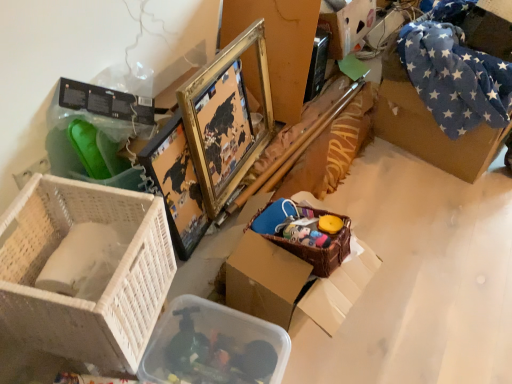
Question: From a real-world perspective, is gold metallic picture frame at upper center physically below white wicker basket at lower left?

Choices:
 (A) no
 (B) yes

Answer: (B)

Question: Is gold metallic picture frame at upper center far from white wicker basket at lower left?

Choices:
 (A) yes
 (B) no

Answer: (B)

Question: From the image's perspective, is gold metallic picture frame at upper center under white wicker basket at lower left?

Choices:
 (A) no
 (B) yes

Answer: (A)

Question: Considering the relative sizes of gold metallic picture frame at upper center and white wicker basket at lower left in the image provided, is gold metallic picture frame at upper center bigger than white wicker basket at lower left?

Choices:
 (A) yes
 (B) no

Answer: (A)

Question: Is gold metallic picture frame at upper center taller than white wicker basket at lower left?

Choices:
 (A) yes
 (B) no

Answer: (A)

Question: Considering their positions, is gold metallic picture frame at upper center located in front of or behind translucent plastic container at lower center, which is the 2th storage box from top to bottom?

Choices:
 (A) behind
 (B) front

Answer: (A)

Question: Does point (204, 110) appear closer or farther from the camera than point (275, 332)?

Choices:
 (A) closer
 (B) farther

Answer: (B)

Question: Visually, is gold metallic picture frame at upper center positioned to the left or to the right of translucent plastic container at lower center, acting as the first storage box starting from the left?

Choices:
 (A) left
 (B) right

Answer: (B)

Question: Looking at their shapes, would you say gold metallic picture frame at upper center is wider or thinner than translucent plastic container at lower center, marked as the 1th storage box in a front-to-back arrangement?

Choices:
 (A) wide
 (B) thin

Answer: (B)

Question: In terms of width, does cardboard box at upper right, positioned as the 1th storage box in back-to-front order, look wider or thinner when compared to white wicker basket at lower left?

Choices:
 (A) thin
 (B) wide

Answer: (A)

Question: Is cardboard box at upper right, marked as the 1th storage box in a right-to-left arrangement, taller or shorter than white wicker basket at lower left?

Choices:
 (A) tall
 (B) short

Answer: (B)

Question: Considering their positions, is cardboard box at upper right, the second storage box positioned from the left, located in front of or behind white wicker basket at lower left?

Choices:
 (A) front
 (B) behind

Answer: (B)

Question: Do you think cardboard box at upper right, the second storage box when ordered from bottom to top, is within white wicker basket at lower left, or outside of it?

Choices:
 (A) outside
 (B) inside

Answer: (A)

Question: Considering the positions of point (134, 355) and point (329, 51), is point (134, 355) closer or farther from the camera than point (329, 51)?

Choices:
 (A) closer
 (B) farther

Answer: (A)

Question: Considering the positions of white wicker basket at lower left and cardboard box at upper right, marked as the 1th storage box in a right-to-left arrangement, in the image, is white wicker basket at lower left bigger or smaller than cardboard box at upper right, marked as the 1th storage box in a right-to-left arrangement,?

Choices:
 (A) big
 (B) small

Answer: (B)